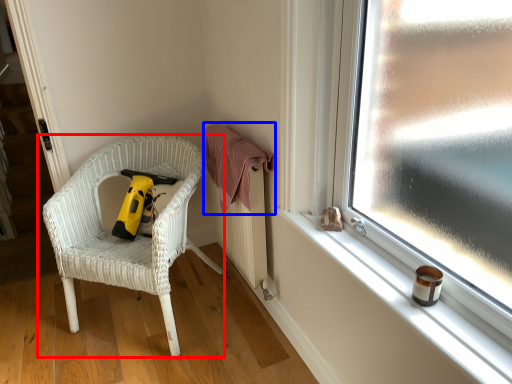
Question: Which object appears farthest to the camera in this image, chair (highlighted by a red box) or clothe (highlighted by a blue box)?

Choices:
 (A) chair
 (B) clothe

Answer: (B)